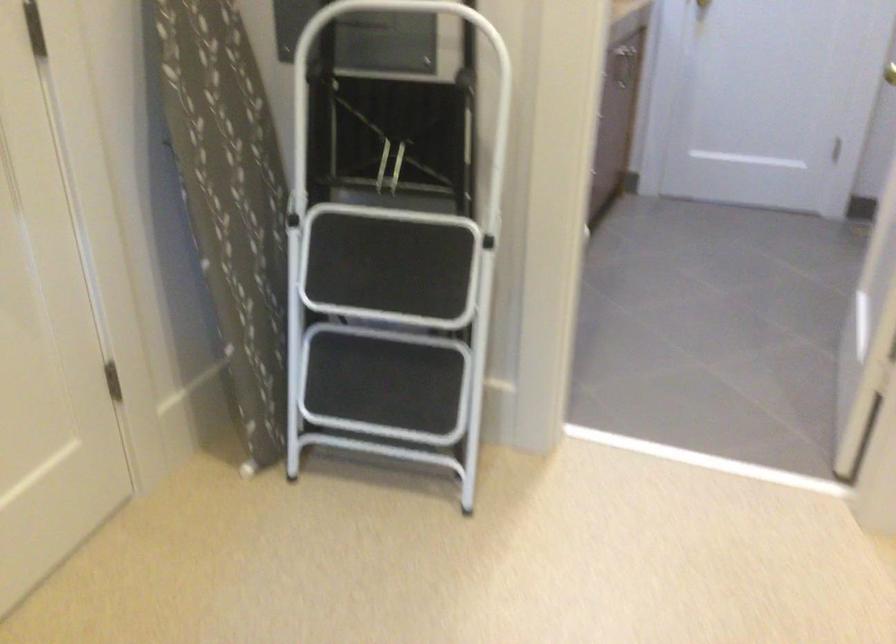
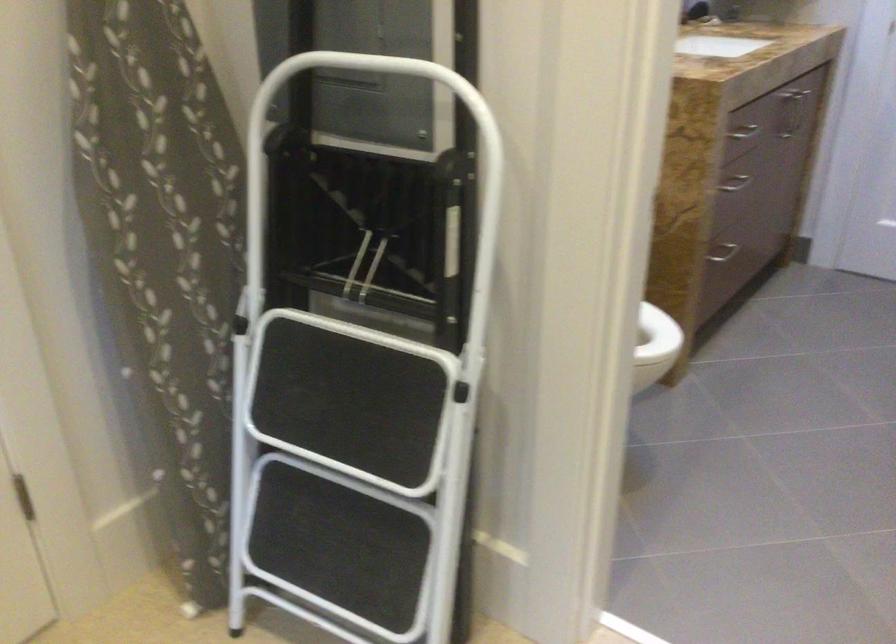
Question: The first image is from the beginning of the video and the second image is from the end. How did the camera likely rotate when shooting the video?

Choices:
 (A) Left
 (B) Right
 (C) Up
 (D) Down

Answer: (A)